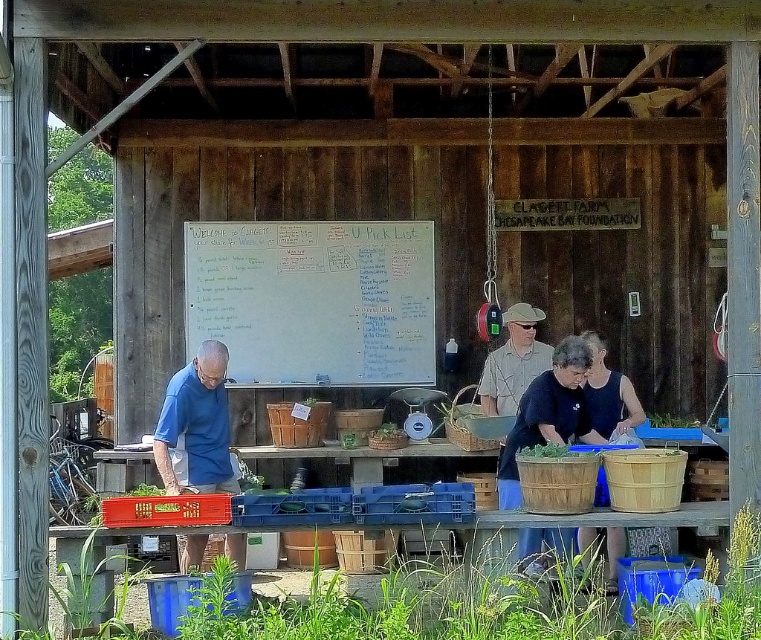
You are standing at the entrance of the wooden pavilion and see the point at coordinates (565, 406). Which object is this point located on?

The point at coordinates (565, 406) is located on the wooden baskets at center.

In the scene shown: You are a farmer standing at the matte blue shirt at left position. You need to reach the whiteboard at center to write down today sales. Can you reach it without moving from your current position?

The distance between the whiteboard at center and matte blue shirt at left is 1.69 meters. Since the farmer is at the matte blue shirt at left position, they would need to stretch or move closer to reach the whiteboard at center, which is 1.69 meters away.

You are a customer at this outdoor market stand. You see the whiteboard at center and the matte blue shirt at left. Which object is positioned to the right of the other?

The whiteboard at center is positioned to the right of the matte blue shirt at left.